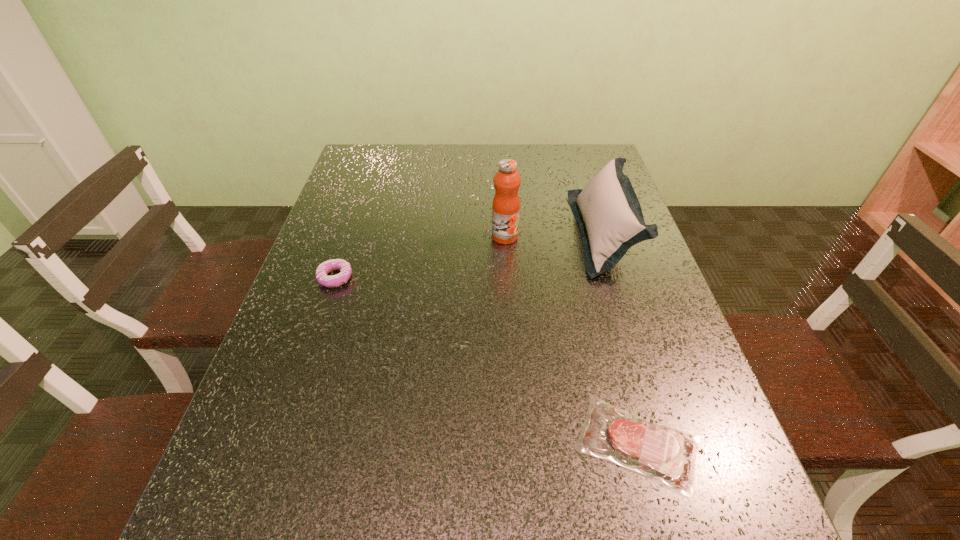
In the image, there is a desktop. At what (x,y) coordinates should I click in order to perform the action: click on free space at the far right corner. Please return your answer as a coordinate pair (x, y). The height and width of the screenshot is (540, 960). Looking at the image, I should click on (594, 166).

This screenshot has height=540, width=960. In order to click on free spot between the leftmost object and the cushion in this screenshot , I will do `click(469, 256)`.

At what (x,y) coordinates should I click in order to perform the action: click on free space that is in between the third shortest object and the tallest object. Please return your answer as a coordinate pair (x, y). Looking at the image, I should click on (554, 235).

This screenshot has height=540, width=960. Identify the location of free space that is in between the cushion and the steak. (620, 339).

Identify the location of free space between the third tallest object and the nearest object. (487, 361).

Identify the location of free point between the shortest object and the tallest object. (571, 340).

Locate an element on the screen. This screenshot has height=540, width=960. free space that is in between the cushion and the doughnut is located at coordinates (469, 256).

This screenshot has width=960, height=540. What are the coordinates of `vacant space that's between the nearest object and the second object from left to right` in the screenshot? It's located at (571, 340).

Identify the location of vacant space that is in between the tallest object and the second tallest object. Image resolution: width=960 pixels, height=540 pixels. (554, 235).

Identify the location of free space between the cushion and the second shortest object. (469, 256).